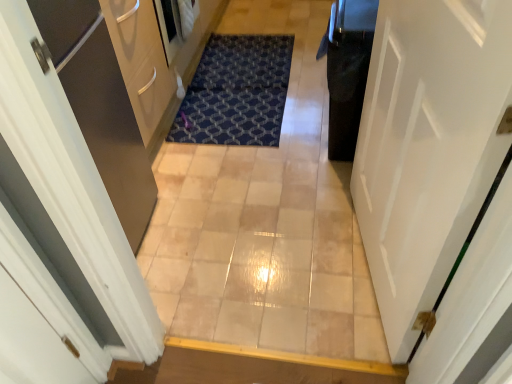
The image size is (512, 384). What are the coordinates of `free space below blue textured mat at center (from a real-world perspective)` in the screenshot? It's located at (243, 81).